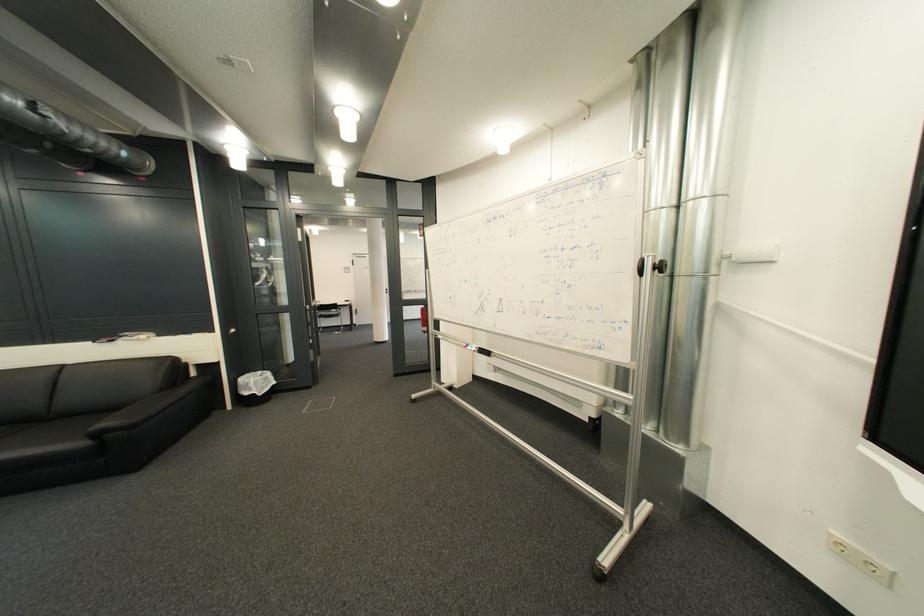
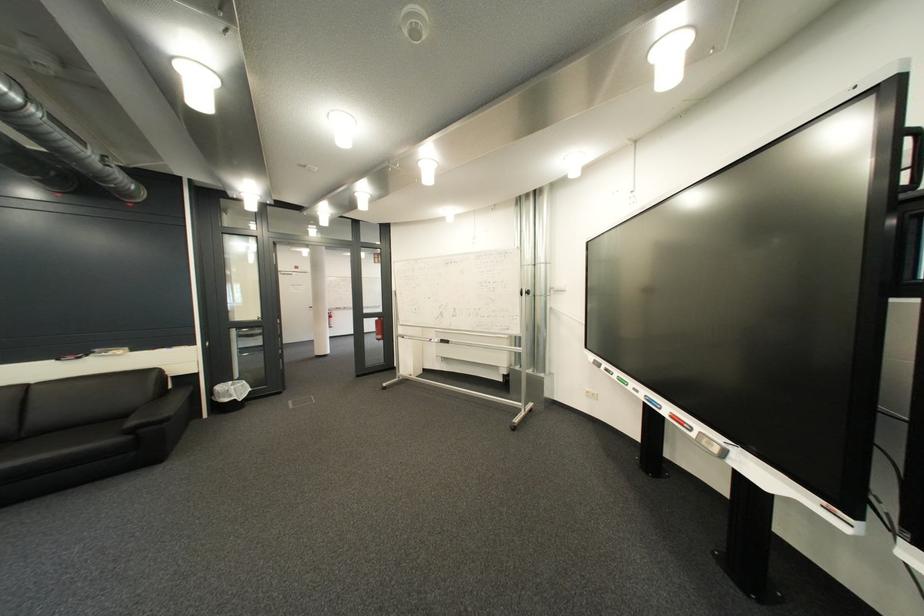
Where in the second image is the point corresponding to (612,260) from the first image?

(518, 290)